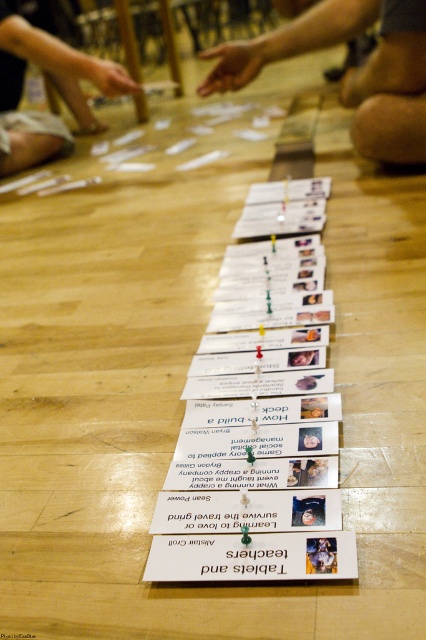
Between white paper cards at center and skinny jeans at center, which one appears on the left side from the viewer's perspective?

white paper cards at center is more to the left.

Measure the distance between point (170, 561) and camera.

The distance of point (170, 561) from camera is 33.73 inches.

The image size is (426, 640). What do you see at coordinates (253, 467) in the screenshot? I see `white paper cards at center` at bounding box center [253, 467].

This screenshot has height=640, width=426. I want to click on white paper cards at center, so click(x=253, y=467).

This screenshot has height=640, width=426. What do you see at coordinates (351, 68) in the screenshot?
I see `skinny jeans at center` at bounding box center [351, 68].

Does skinny jeans at center lie in front of matte black hand at upper left?

Yes, skinny jeans at center is in front of matte black hand at upper left.

Which is behind, point (215, 54) or point (5, 90)?

Point (5, 90)

The image size is (426, 640). In order to click on skinny jeans at center in this screenshot , I will do `click(351, 68)`.

Looking at this image, can you confirm if white paper cards at center is shorter than matte black hand at upper left?

Correct, white paper cards at center is not as tall as matte black hand at upper left.

Who is more distant from viewer, (229, 259) or (20, 129)?

Point (20, 129)

Between point (218, 387) and point (20, 157), which one is positioned in front?

Positioned in front is point (218, 387).

Find the location of a particular element. Image resolution: width=426 pixels, height=640 pixels. white paper cards at center is located at coordinates (253, 467).